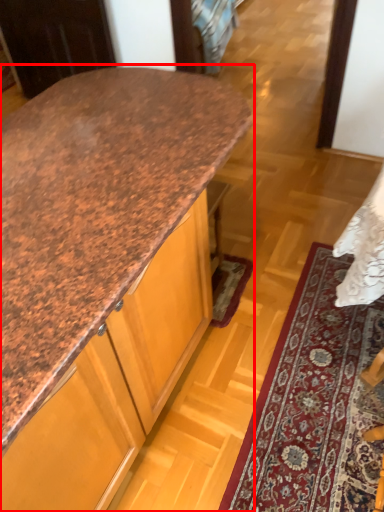
Question: From the image's perspective, where is countertop (annotated by the red box) located relative to mat?

Choices:
 (A) above
 (B) below

Answer: (A)